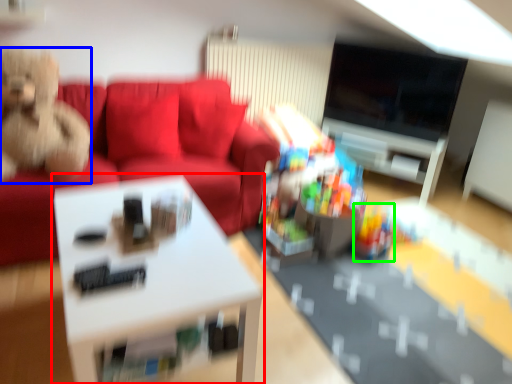
Question: Which object is positioned closest to table (highlighted by a red box)? Select from toy (highlighted by a blue box) and toy (highlighted by a green box).

Choices:
 (A) toy
 (B) toy

Answer: (A)